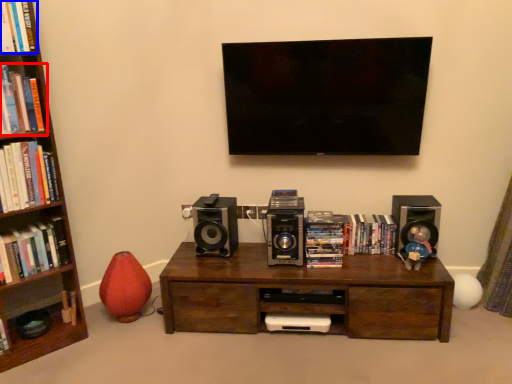
Question: Which object is further to the camera taking this photo, book (highlighted by a red box) or book (highlighted by a blue box)?

Choices:
 (A) book
 (B) book

Answer: (A)